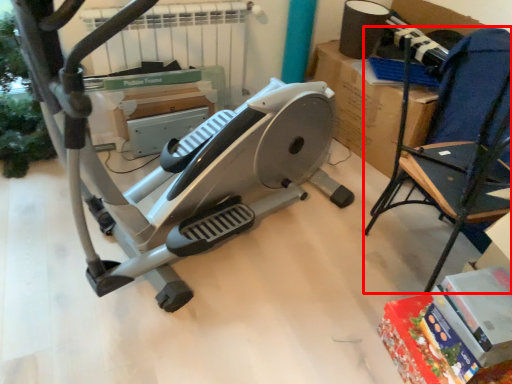
Question: Observing the image, what is the correct spatial positioning of chair (annotated by the red box) in reference to stationary bicycle?

Choices:
 (A) right
 (B) left

Answer: (A)